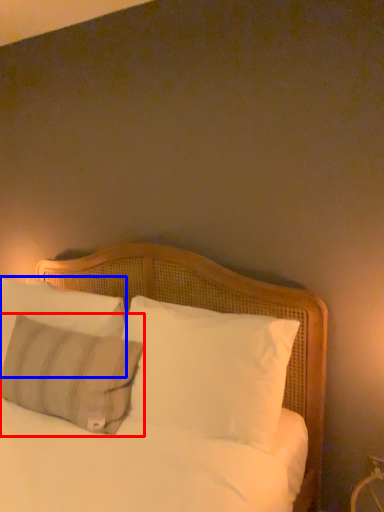
Question: Which of the following is the closest to the observer, pillow (highlighted by a red box) or pillow (highlighted by a blue box)?

Choices:
 (A) pillow
 (B) pillow

Answer: (A)